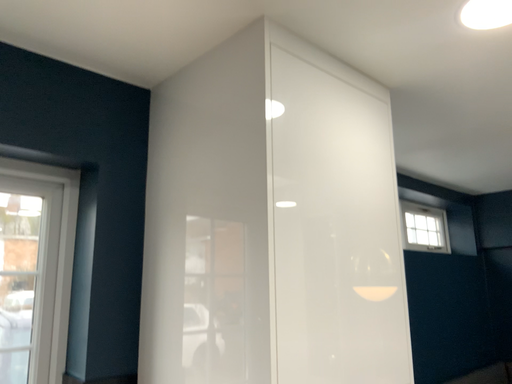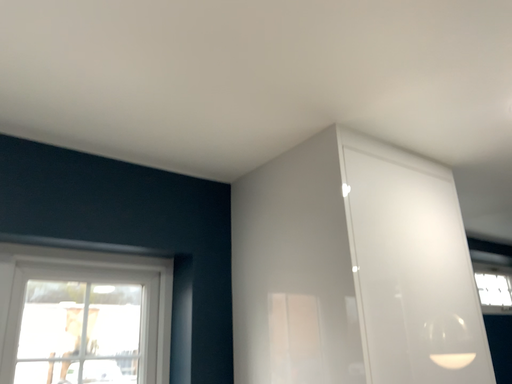
Question: How did the camera likely rotate when shooting the video?

Choices:
 (A) rotated right
 (B) rotated left

Answer: (B)